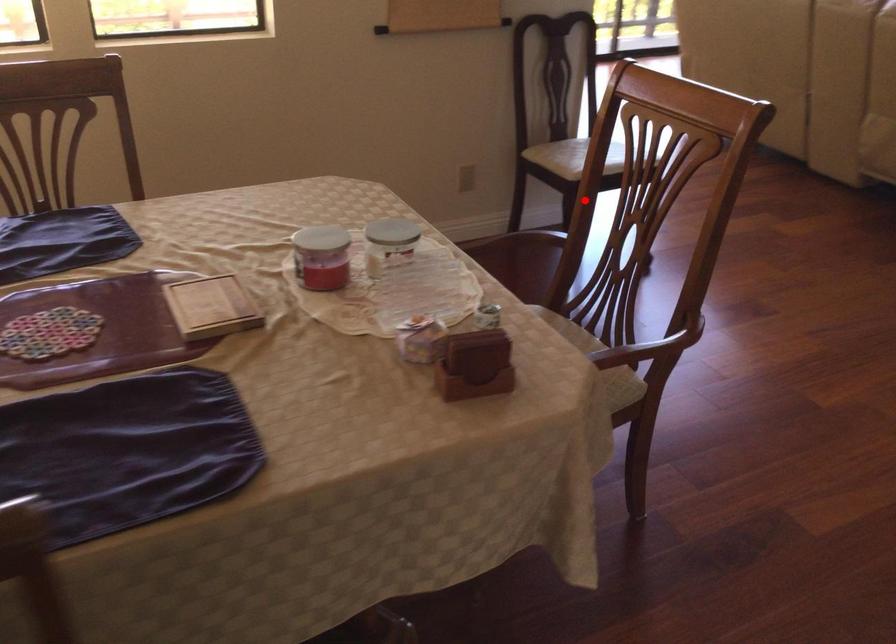
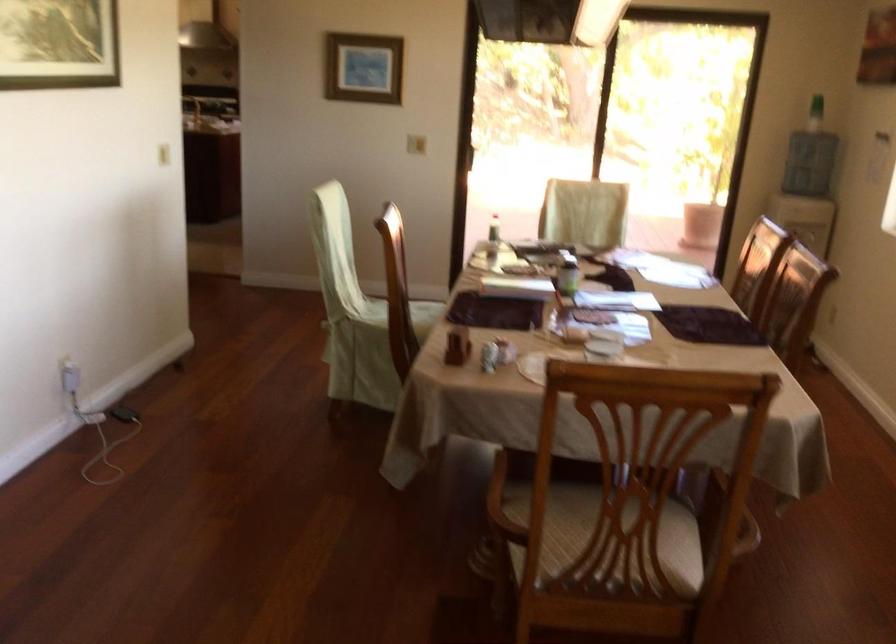
Locate, in the second image, the point that corresponds to the highlighted location in the first image.

(722, 509)